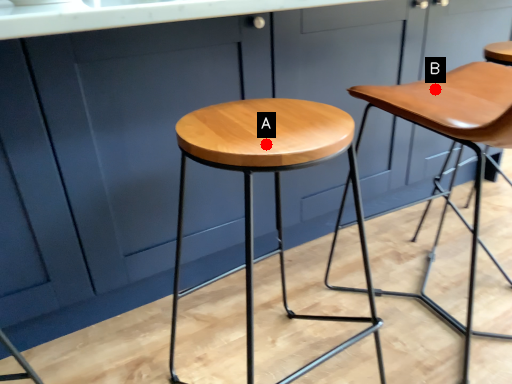
Question: Two points are circled on the image, labeled by A and B beside each circle. Which point appears closest to the camera in this image?

Choices:
 (A) A is closer
 (B) B is closer

Answer: (A)